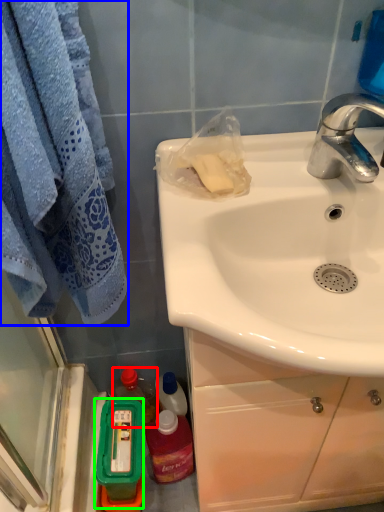
Question: Considering the real-world distances, which object is farthest from bottle (highlighted by a red box)? towel/napkin (highlighted by a blue box) or mouthwash (highlighted by a green box)?

Choices:
 (A) towel/napkin
 (B) mouthwash

Answer: (A)